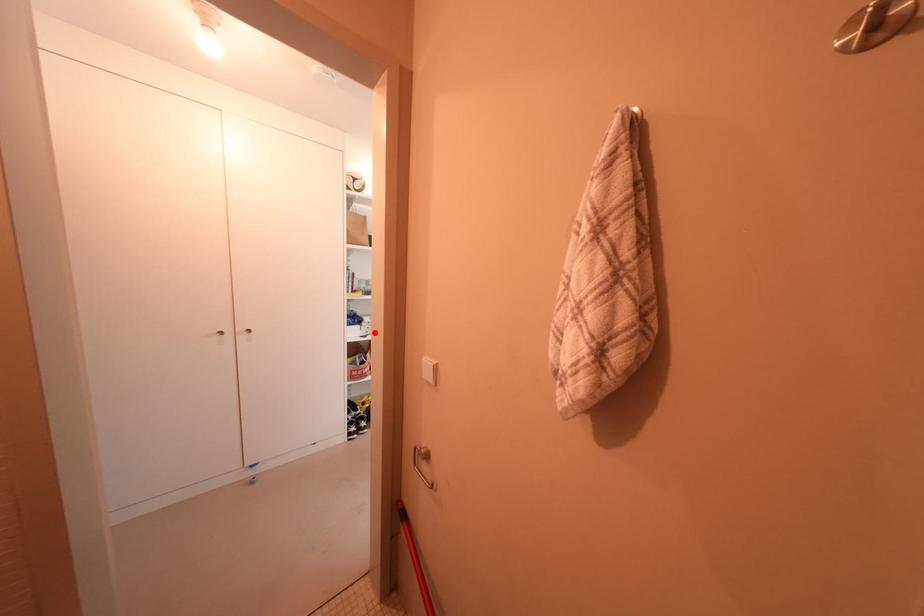
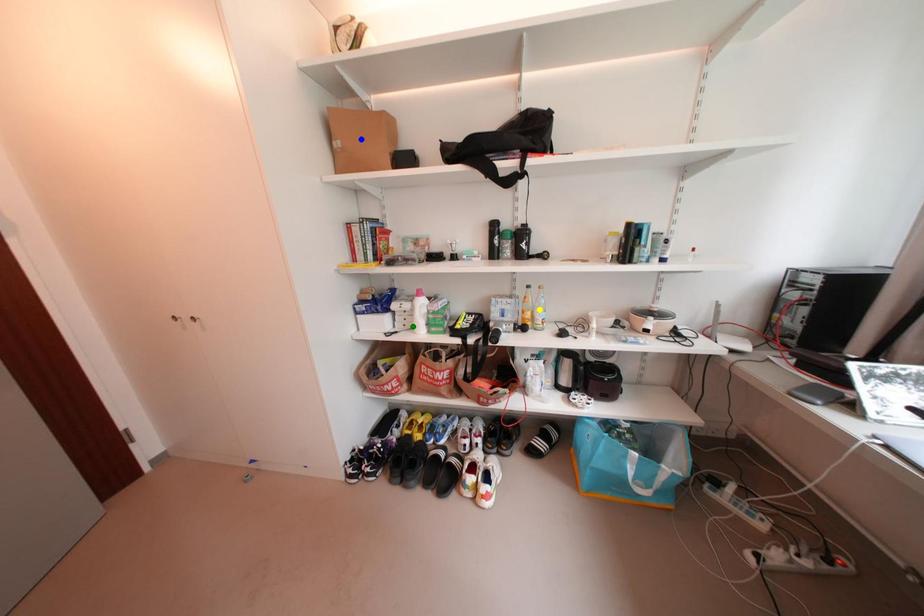
Question: I am providing you with two images of the same scene from different viewpoints. A red point is marked on the first image. You are given multiple points on the second image. In image 2, which mark is for the same physical point as the one in image 1?

Choices:
 (A) blue point
 (B) green point
 (C) yellow point

Answer: (B)